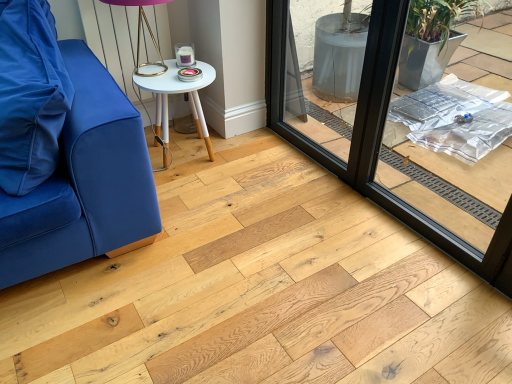
Question: Is white wood side table at center to the right of black glass window frame at center from the viewer's perspective?

Choices:
 (A) yes
 (B) no

Answer: (B)

Question: Can you confirm if white wood side table at center is wider than black glass window frame at center?

Choices:
 (A) yes
 (B) no

Answer: (A)

Question: From a real-world perspective, is white wood side table at center over black glass window frame at center?

Choices:
 (A) no
 (B) yes

Answer: (A)

Question: Is black glass window frame at center inside white wood side table at center?

Choices:
 (A) no
 (B) yes

Answer: (A)

Question: Is white wood side table at center aimed at black glass window frame at center?

Choices:
 (A) yes
 (B) no

Answer: (B)

Question: Is matte blue cushion at left wider or thinner than metallic gold table lamp at upper center?

Choices:
 (A) thin
 (B) wide

Answer: (A)

Question: Considering the positions of matte blue cushion at left and metallic gold table lamp at upper center in the image, is matte blue cushion at left bigger or smaller than metallic gold table lamp at upper center?

Choices:
 (A) small
 (B) big

Answer: (B)

Question: In the image, is matte blue cushion at left on the left side or the right side of metallic gold table lamp at upper center?

Choices:
 (A) right
 (B) left

Answer: (B)

Question: Is matte blue cushion at left inside or outside of metallic gold table lamp at upper center?

Choices:
 (A) outside
 (B) inside

Answer: (A)

Question: Do you think metallic gold table lamp at upper center is within white wood side table at center, or outside of it?

Choices:
 (A) outside
 (B) inside

Answer: (A)

Question: Based on their positions, is metallic gold table lamp at upper center located to the left or right of white wood side table at center?

Choices:
 (A) right
 (B) left

Answer: (B)

Question: From their relative heights in the image, would you say metallic gold table lamp at upper center is taller or shorter than white wood side table at center?

Choices:
 (A) short
 (B) tall

Answer: (A)

Question: Considering the positions of metallic gold table lamp at upper center and white wood side table at center in the image, is metallic gold table lamp at upper center wider or thinner than white wood side table at center?

Choices:
 (A) thin
 (B) wide

Answer: (A)

Question: Considering the positions of black glass window frame at center and metallic gold table lamp at upper center in the image, is black glass window frame at center taller or shorter than metallic gold table lamp at upper center?

Choices:
 (A) tall
 (B) short

Answer: (A)

Question: Considering their positions, is black glass window frame at center located in front of or behind metallic gold table lamp at upper center?

Choices:
 (A) behind
 (B) front

Answer: (B)